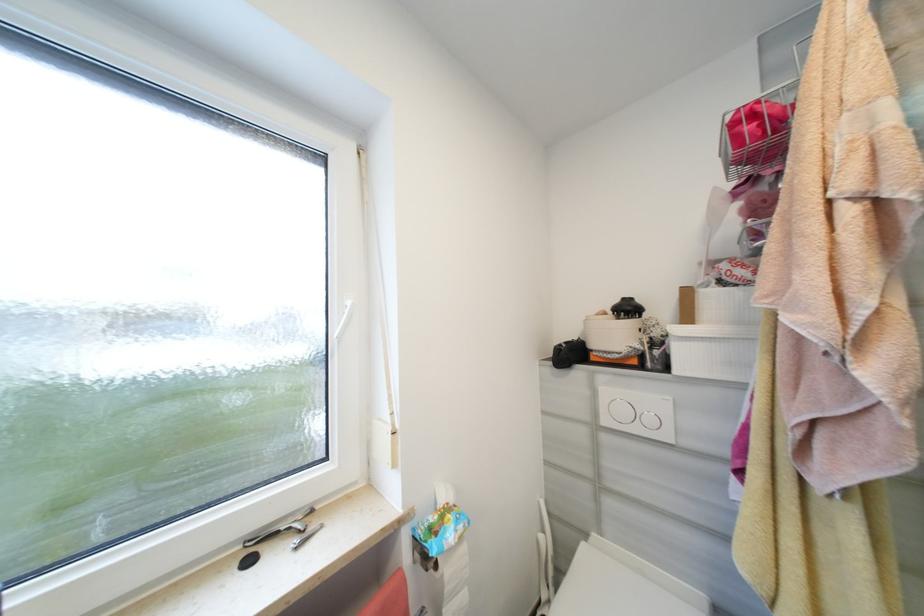
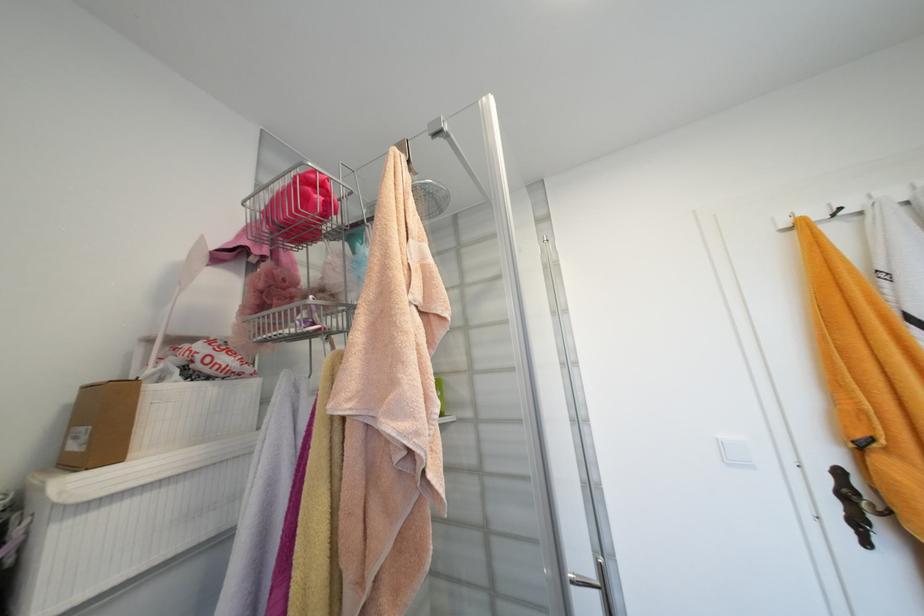
The point at (707, 265) is marked in the first image. Where is the corresponding point in the second image?

(154, 342)